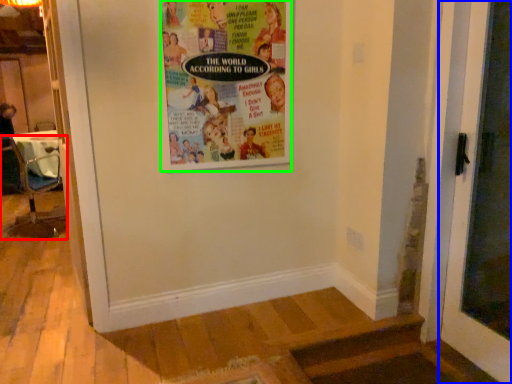
Question: Considering the real-world distances, which object is closest to chair (highlighted by a red box)? door (highlighted by a blue box) or poster (highlighted by a green box).

Choices:
 (A) door
 (B) poster

Answer: (B)